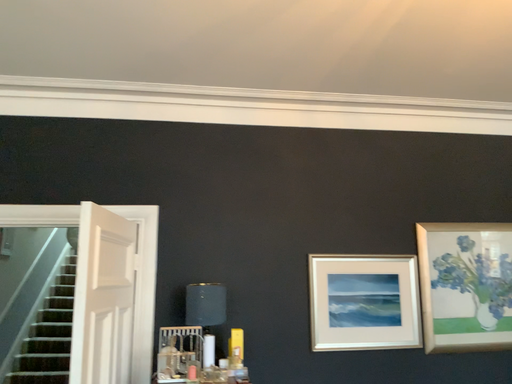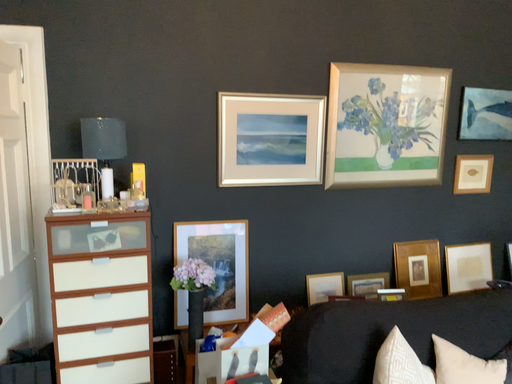
Question: Which way did the camera rotate in the video?

Choices:
 (A) rotated upward
 (B) rotated downward

Answer: (B)